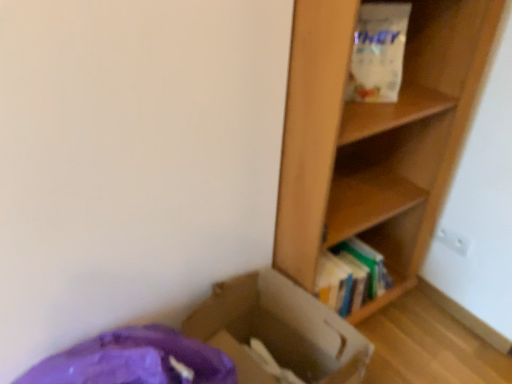
What do you see at coordinates (375, 137) in the screenshot? I see `wooden shelf at right` at bounding box center [375, 137].

What do you see at coordinates (378, 52) in the screenshot? I see `white matte paper bag at upper right` at bounding box center [378, 52].

The image size is (512, 384). What do you see at coordinates (383, 236) in the screenshot?
I see `wooden bookshelf at right` at bounding box center [383, 236].

Where is `wooden shelf at right`? wooden shelf at right is located at coordinates (375, 137).

Is cardboard box at lower left inside the boundaries of wooden bookshelf at right, or outside?

cardboard box at lower left cannot be found inside wooden bookshelf at right.

Which object is more forward, cardboard box at lower left or wooden bookshelf at right?

Positioned in front is cardboard box at lower left.

From a real-world perspective, which is physically above, cardboard box at lower left or wooden bookshelf at right?

wooden bookshelf at right, from a real-world perspective.

Can you tell me how much white matte paper bag at upper right and wooden shelf at right differ in facing direction?

The angular difference between white matte paper bag at upper right and wooden shelf at right is 32.1 degrees.

Is white matte paper bag at upper right aimed at wooden shelf at right?

Yes.

Can you confirm if white matte paper bag at upper right is wider than wooden shelf at right?

No, white matte paper bag at upper right is not wider than wooden shelf at right.

Which object is thinner, white matte paper bag at upper right or wooden bookshelf at right?

white matte paper bag at upper right.

Is white matte paper bag at upper right not within wooden bookshelf at right?

white matte paper bag at upper right lies outside wooden bookshelf at right's area.

How far apart are white matte paper bag at upper right and wooden bookshelf at right?

white matte paper bag at upper right is 20.85 inches away from wooden bookshelf at right.

Based on the photo, is there a large distance between white matte paper bag at upper right and wooden bookshelf at right?

No, white matte paper bag at upper right is not far away from wooden bookshelf at right.

From the picture: Does wooden shelf at right have a lesser width compared to cardboard box at lower left?

Incorrect, the width of wooden shelf at right is not less than that of cardboard box at lower left.

Who is taller, wooden shelf at right or cardboard box at lower left?

wooden shelf at right.

Would you say wooden shelf at right is outside cardboard box at lower left?

wooden shelf at right lies outside cardboard box at lower left's area.

Does wooden shelf at right come in front of cardboard box at lower left?

Yes, wooden shelf at right is closer to the camera.

From the image's perspective, which is above, white matte paper bag at upper right or cardboard box at lower left?

white matte paper bag at upper right.

Looking at this image, is white matte paper bag at upper right facing towards cardboard box at lower left?

No, white matte paper bag at upper right is not facing towards cardboard box at lower left.

Is cardboard box at lower left completely or partially inside white matte paper bag at upper right?

Definitely not — cardboard box at lower left is not inside white matte paper bag at upper right.

Does white matte paper bag at upper right have a larger size compared to cardboard box at lower left?

No.

From a real-world perspective, relative to white matte paper bag at upper right, is wooden bookshelf at right vertically above or below?

From a real-world perspective, wooden bookshelf at right is physically below white matte paper bag at upper right.

Is wooden bookshelf at right turned away from white matte paper bag at upper right?

No, wooden bookshelf at right is not facing the opposite direction of white matte paper bag at upper right.

Looking at this image, considering the relative positions of wooden bookshelf at right and white matte paper bag at upper right in the image provided, is wooden bookshelf at right to the left of white matte paper bag at upper right from the viewer's perspective?

Yes, wooden bookshelf at right is to the left of white matte paper bag at upper right.

From the image's perspective, would you say wooden bookshelf at right is shown under white matte paper bag at upper right?

Correct, wooden bookshelf at right appears lower than white matte paper bag at upper right in the image.

Considering the relative sizes of wooden bookshelf at right and cardboard box at lower left in the image provided, is wooden bookshelf at right shorter than cardboard box at lower left?

Correct, wooden bookshelf at right is not as tall as cardboard box at lower left.

Can you tell me how much wooden bookshelf at right and cardboard box at lower left differ in facing direction?

They differ by 8.81 degrees in their facing directions.

Looking at this image, is wooden bookshelf at right outside of cardboard box at lower left?

Yes, wooden bookshelf at right is not within cardboard box at lower left.

Identify the location of cabinet positioned vertically above the cardboard box at lower left (from a real-world perspective). (383, 236).

Identify the location of paper bag above the wooden shelf at right (from the image's perspective). tap(378, 52).

Estimate the real-world distances between objects in this image. Which object is further from wooden bookshelf at right, white matte paper bag at upper right or cardboard box at lower left?

white matte paper bag at upper right lies further to wooden bookshelf at right than the other object.

Based on the photo, considering their positions, is wooden bookshelf at right positioned further to cardboard box at lower left than white matte paper bag at upper right?

Among the two, white matte paper bag at upper right is located further to cardboard box at lower left.

Estimate the real-world distances between objects in this image. Which object is further from cardboard box at lower left, wooden shelf at right or white matte paper bag at upper right?

white matte paper bag at upper right lies further to cardboard box at lower left than the other object.

Considering their positions, is wooden bookshelf at right positioned further to wooden shelf at right than white matte paper bag at upper right?

Among the two, white matte paper bag at upper right is located further to wooden shelf at right.

When comparing their distances from cardboard box at lower left, does wooden shelf at right or wooden bookshelf at right seem further?

wooden bookshelf at right lies further to cardboard box at lower left than the other object.

From the image, which object appears to be farther from wooden bookshelf at right, white matte paper bag at upper right or wooden shelf at right?

white matte paper bag at upper right lies further to wooden bookshelf at right than the other object.

Considering their positions, is wooden bookshelf at right positioned further to white matte paper bag at upper right than wooden shelf at right?

The object further to white matte paper bag at upper right is wooden bookshelf at right.

Which object lies nearer to the anchor point wooden bookshelf at right, cardboard box at lower left or white matte paper bag at upper right?

cardboard box at lower left is closer to wooden bookshelf at right.

Identify the location of cabinet between white matte paper bag at upper right and cardboard box at lower left in the up-down direction. (383, 236).

You are a GUI agent. You are given a task and a screenshot of the screen. Output one action in this format:
    pyautogui.click(x=<x>, y=<y>)
    Task: Click on the shelf that lies between white matte paper bag at upper right and wooden bookshelf at right from top to bottom
    This screenshot has width=512, height=384.
    Given the screenshot: What is the action you would take?
    pyautogui.click(x=375, y=137)

Locate an element on the screen. shelf between white matte paper bag at upper right and cardboard box at lower left in the up-down direction is located at coordinates (375, 137).

I want to click on cabinet between wooden shelf at right and cardboard box at lower left from top to bottom, so click(383, 236).